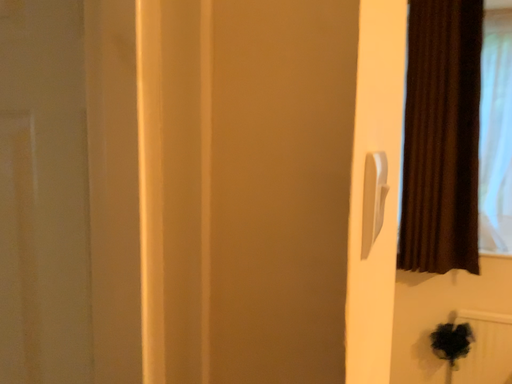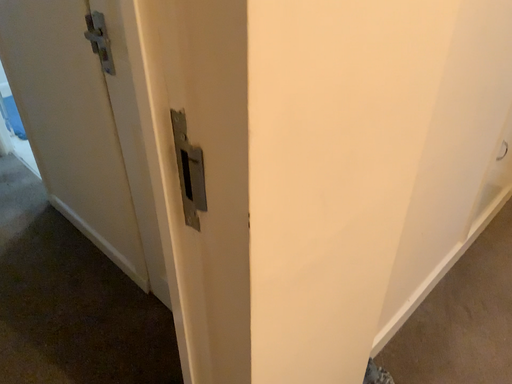
Question: How did the camera likely rotate when shooting the video?

Choices:
 (A) rotated right
 (B) rotated left

Answer: (B)